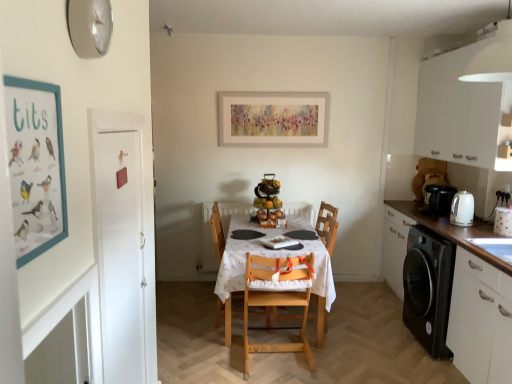
Locate an element on the screen. The height and width of the screenshot is (384, 512). vacant region to the left of wooden chair at center, acting as the second chair starting from the front is located at coordinates (190, 316).